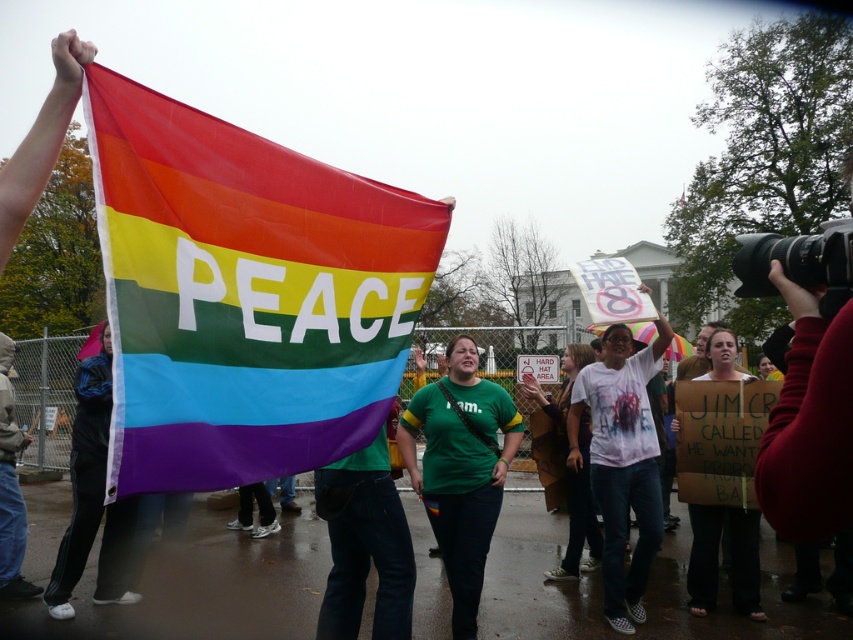
You are a photographer taking a picture of the protest scene. You have two points of interest marked in your viewfinder at coordinates point (271,177) and point (427,483). Which point is closer to your camera lens?

Point (271,177) is closer to the camera lens than point (427,483).